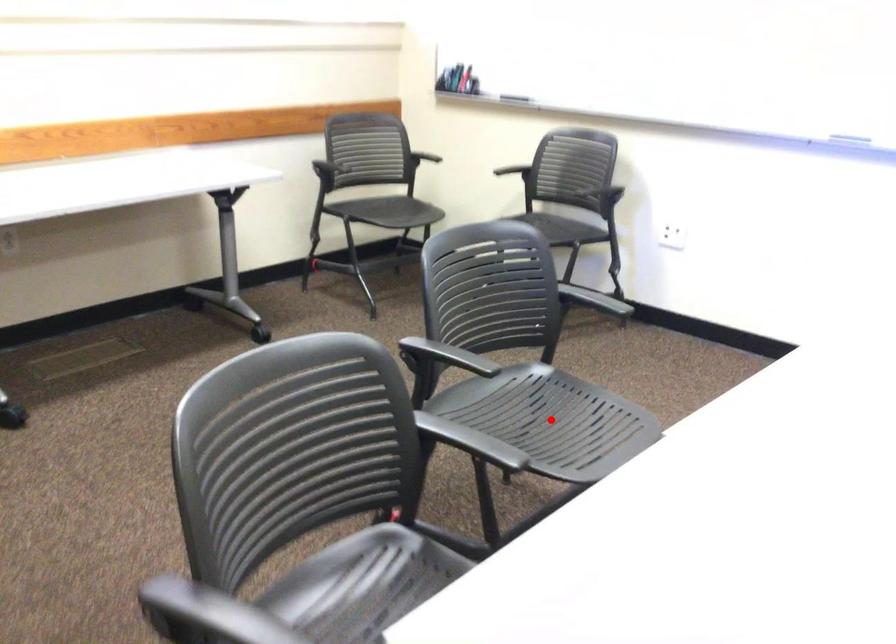
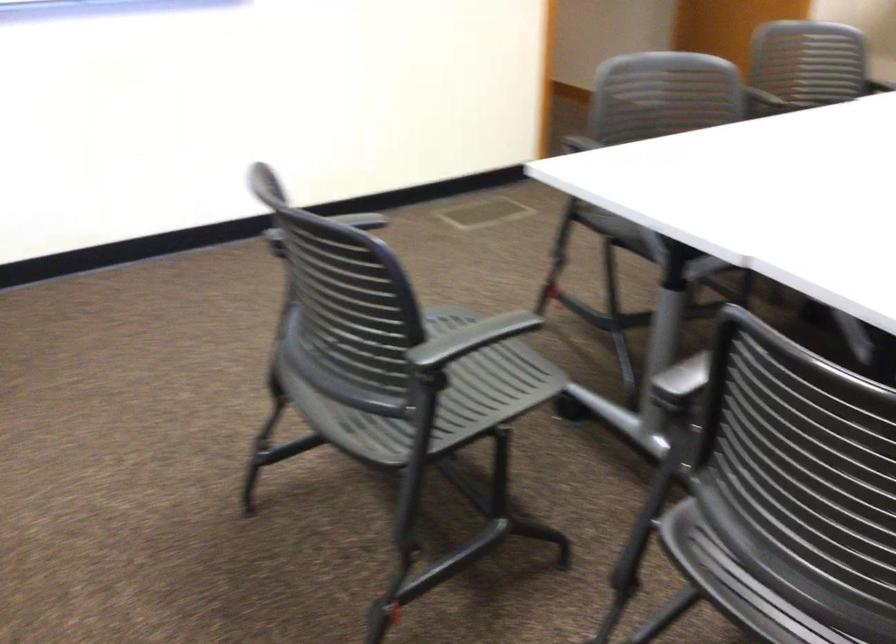
Question: I am providing you with two images of the same scene from different viewpoints. A red point is marked on the first image. Can you still see the location of the red point in image 2?

Choices:
 (A) Yes
 (B) No

Answer: (B)